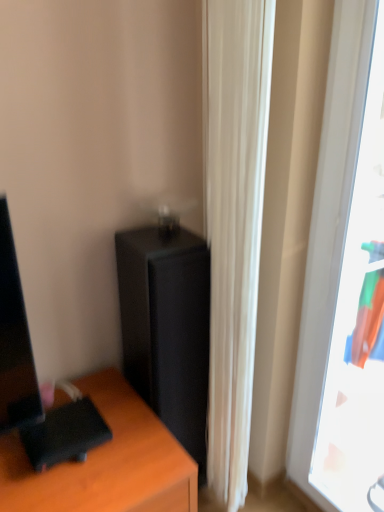
Where is `vacant space situated above black matte/file cabinet at center (from a real-world perspective)`? vacant space situated above black matte/file cabinet at center (from a real-world perspective) is located at coordinates (141, 241).